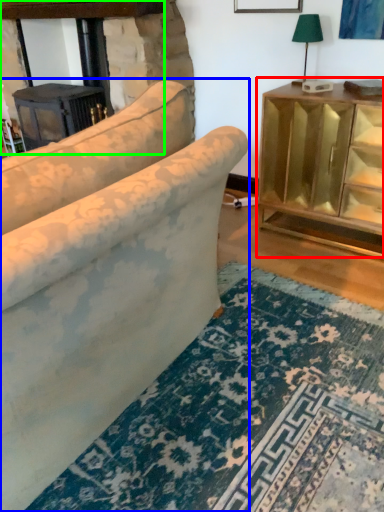
Question: Estimate the real-world distances between objects in this image. Which object is closer to table (highlighted by a red box), studio couch (highlighted by a blue box) or fireplace (highlighted by a green box)?

Choices:
 (A) studio couch
 (B) fireplace

Answer: (A)